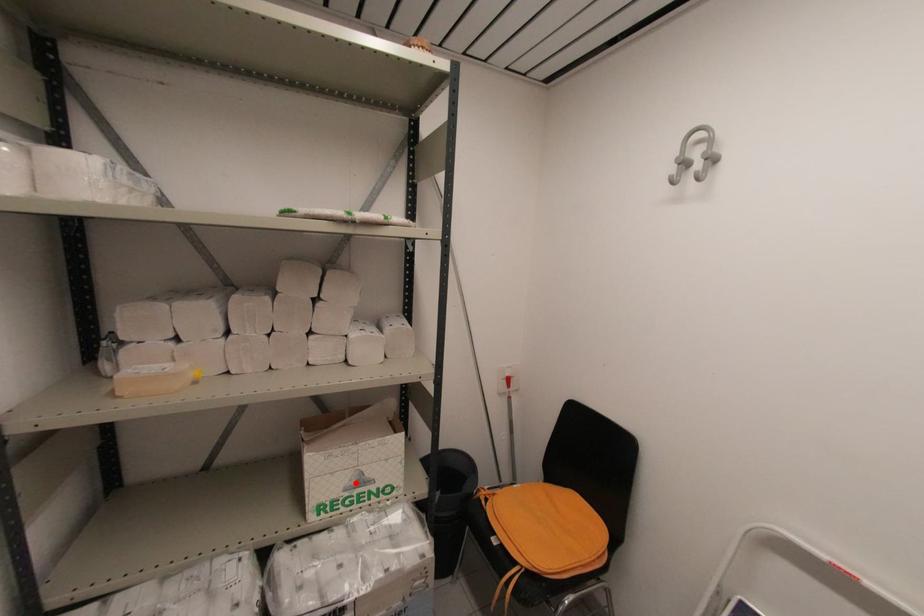
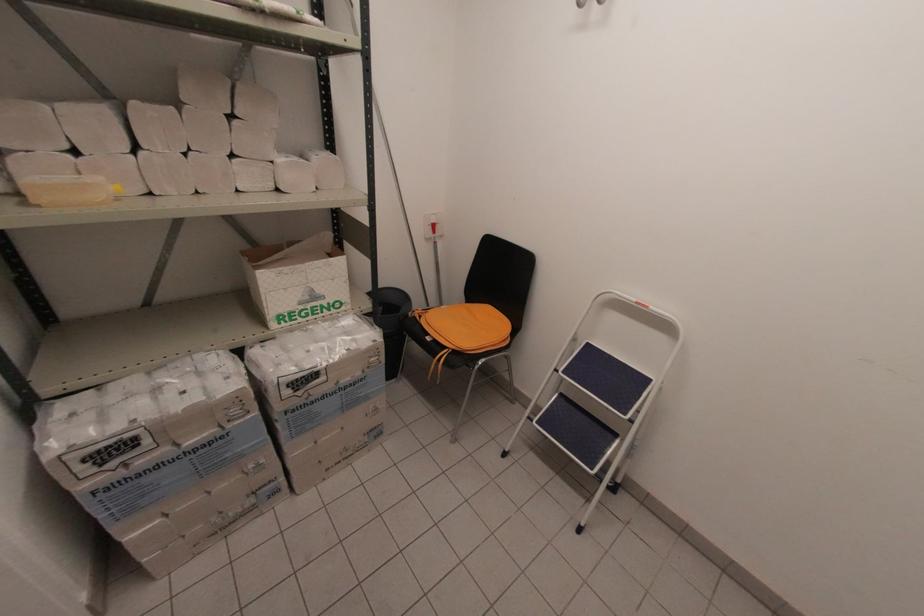
Locate, in the second image, the point that corresponds to the highlighted location in the first image.

(309, 298)